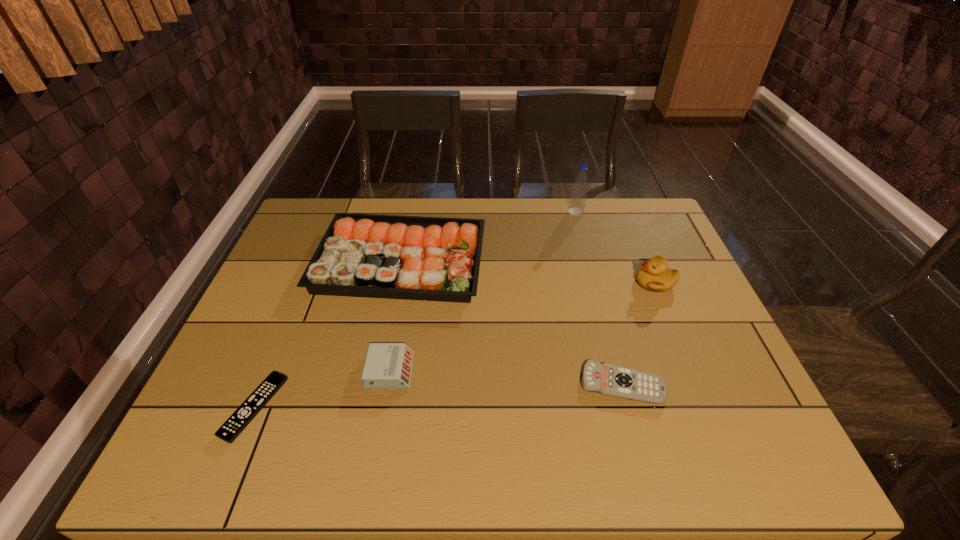
Where is `object that is at the near edge`? Image resolution: width=960 pixels, height=540 pixels. object that is at the near edge is located at coordinates (237, 422).

Where is `platter located in the left edge section of the desktop`? platter located in the left edge section of the desktop is located at coordinates (360, 255).

The width and height of the screenshot is (960, 540). Find the location of `remote control at the left edge`. remote control at the left edge is located at coordinates (237, 422).

At what (x,y) coordinates should I click in order to perform the action: click on object that is positioned at the right edge. Please return your answer as a coordinate pair (x, y). Looking at the image, I should click on (654, 275).

Identify the location of object situated at the far left corner. The image size is (960, 540). (360, 255).

Locate an element on the screen. object that is positioned at the near left corner is located at coordinates (237, 422).

Locate an element on the screen. free location at the far edge is located at coordinates (598, 199).

Locate an element on the screen. vacant area at the near edge of the desktop is located at coordinates (322, 448).

Locate an element on the screen. The image size is (960, 540). vacant space at the left edge is located at coordinates pyautogui.click(x=307, y=244).

Find the location of a particular element. The width and height of the screenshot is (960, 540). free space at the right edge of the desktop is located at coordinates (724, 345).